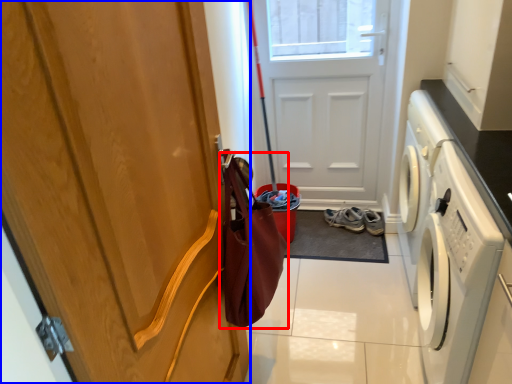
Question: Which object appears farthest to the camera in this image, shopping bag (highlighted by a red box) or door (highlighted by a blue box)?

Choices:
 (A) shopping bag
 (B) door

Answer: (A)